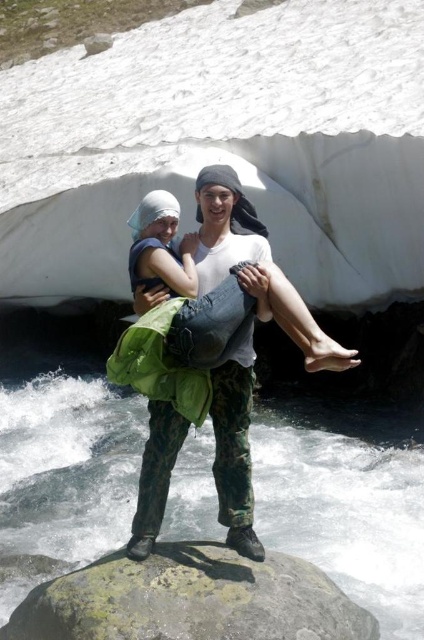
Is gray rough rock at center behind light green fabric skirt at center?

That is False.

Between point (259, 636) and point (243, 228), which one is positioned behind?

Positioned behind is point (243, 228).

Where is `gray rough rock at center`? This screenshot has width=424, height=640. gray rough rock at center is located at coordinates (190, 600).